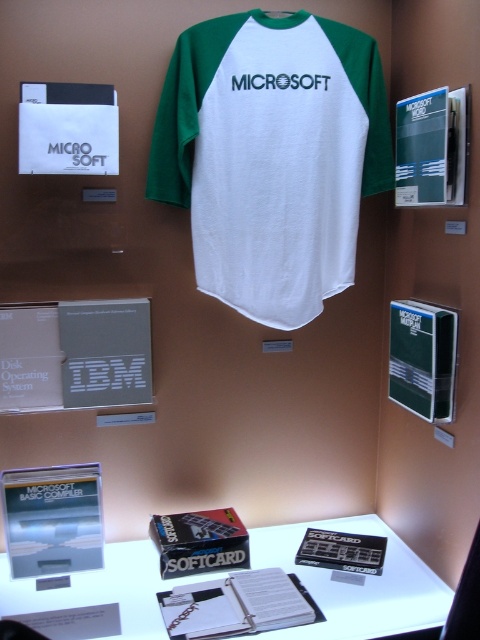
Question: Is green/white jersey at center positioned behind white glossy table at lower center?

Choices:
 (A) no
 (B) yes

Answer: (B)

Question: Is gray cardboard box at lower left behind white paper folder at center?

Choices:
 (A) yes
 (B) no

Answer: (A)

Question: Does green/white jersey at center come in front of white paper folder at center?

Choices:
 (A) no
 (B) yes

Answer: (A)

Question: Estimate the real-world distances between objects in this image. Which object is closer to the white paper folder at center?

Choices:
 (A) green/white jersey at center
 (B) white glossy table at lower center
 (C) gray cardboard box at lower left

Answer: (B)

Question: Which object is the farthest from the green/white jersey at center?

Choices:
 (A) gray cardboard box at lower left
 (B) white paper folder at center

Answer: (B)

Question: Which object is positioned closest to the gray cardboard box at lower left?

Choices:
 (A) green/white jersey at center
 (B) white glossy table at lower center

Answer: (A)